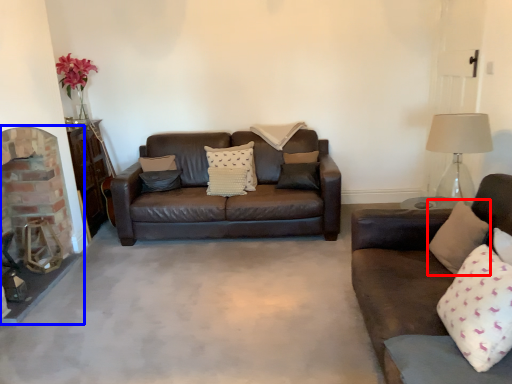
Question: Which point is further to the camera, pillow (highlighted by a red box) or fireplace (highlighted by a blue box)?

Choices:
 (A) pillow
 (B) fireplace

Answer: (B)